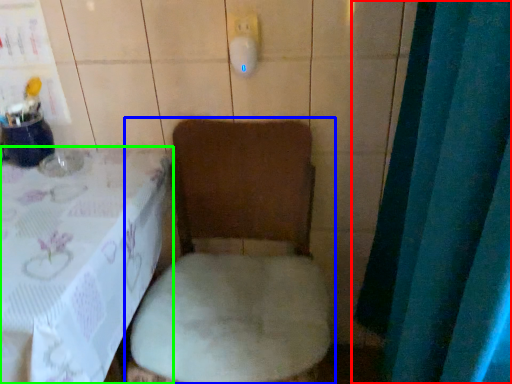
Question: Based on their relative distances, which object is nearer to curtain (highlighted by a red box)? Choose from toilet (highlighted by a blue box) and furniture (highlighted by a green box).

Choices:
 (A) toilet
 (B) furniture

Answer: (A)